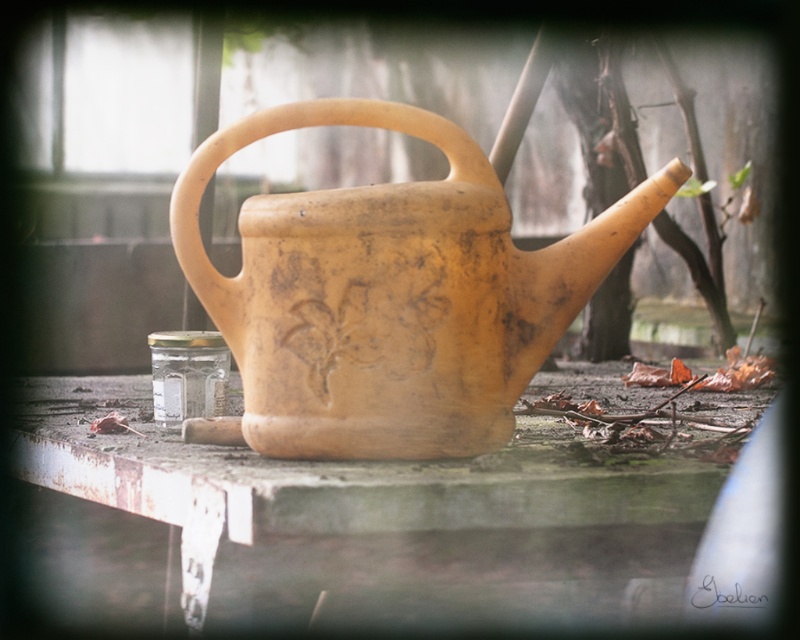
Can you confirm if rusty metal table at center is bigger than matte yellow clay watering can at center?

Indeed, rusty metal table at center has a larger size compared to matte yellow clay watering can at center.

Can you confirm if rusty metal table at center is positioned below matte yellow clay watering can at center?

Yes.

This screenshot has height=640, width=800. In order to click on rusty metal table at center in this screenshot , I will do `click(401, 516)`.